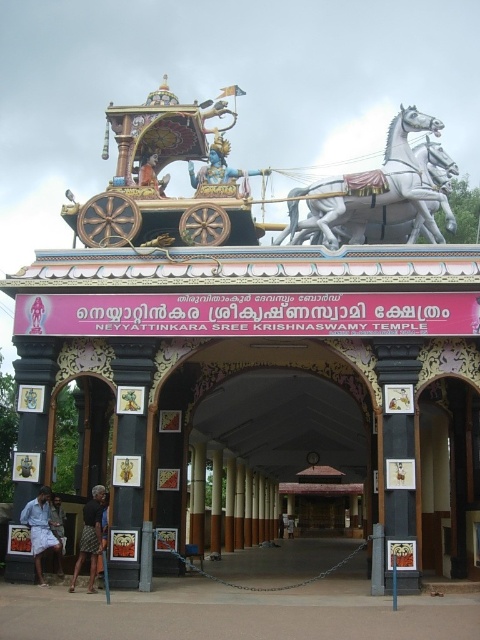
Question: Which object is farther from the camera taking this photo?

Choices:
 (A) dark brown woven skirt at lower left
 (B) white glossy horse at upper center
 (C) dark gray fabric skirt at lower left

Answer: (B)

Question: Can you confirm if white glossy horse at upper center is positioned below light blue cotton shirt at lower left?

Choices:
 (A) yes
 (B) no

Answer: (B)

Question: Can you confirm if white glossy horse at upper center is wider than light blue cotton shirt at lower left?

Choices:
 (A) no
 (B) yes

Answer: (B)

Question: Which point is farther from the camera taking this photo?

Choices:
 (A) (59, 548)
 (B) (429, 211)

Answer: (B)

Question: Which point appears farthest from the camera in this image?

Choices:
 (A) (69, 588)
 (B) (39, 496)

Answer: (A)

Question: Does light blue cotton shirt at lower left appear under dark gray fabric skirt at lower left?

Choices:
 (A) no
 (B) yes

Answer: (B)